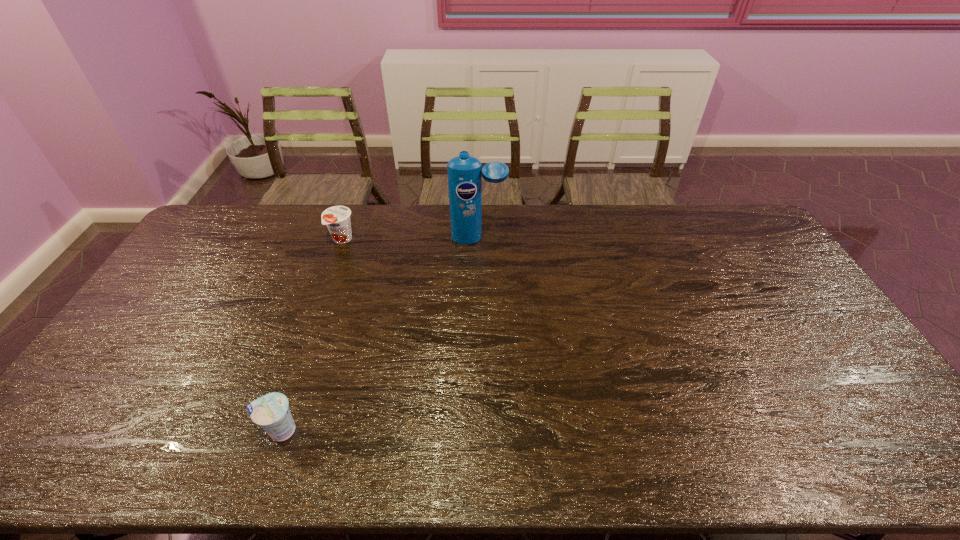
I want to click on vacant point located between the rightmost object and the nearer yogurt, so click(x=379, y=335).

Image resolution: width=960 pixels, height=540 pixels. What are the coordinates of `free space that is in between the farther yogurt and the nearest object` in the screenshot? It's located at (311, 335).

The image size is (960, 540). I want to click on vacant point located between the farther yogurt and the shampoo, so click(410, 239).

Where is `free point between the nearest object and the shampoo`? free point between the nearest object and the shampoo is located at coordinates (379, 335).

Where is `free space between the nearer yogurt and the farther yogurt`? Image resolution: width=960 pixels, height=540 pixels. free space between the nearer yogurt and the farther yogurt is located at coordinates (311, 335).

The height and width of the screenshot is (540, 960). Find the location of `object that is the nearest to the shampoo`. object that is the nearest to the shampoo is located at coordinates (337, 218).

Locate an element on the screen. The width and height of the screenshot is (960, 540). object that is the second nearest to the nearer yogurt is located at coordinates (465, 172).

Locate an element on the screen. vacant space that satisfies the following two spatial constraints: 1. on the front side of the farther yogurt; 2. on the left side of the nearest object is located at coordinates (275, 430).

The width and height of the screenshot is (960, 540). Find the location of `vacant area in the image that satisfies the following two spatial constraints: 1. on the back side of the nearer yogurt; 2. on the right side of the tallest object`. vacant area in the image that satisfies the following two spatial constraints: 1. on the back side of the nearer yogurt; 2. on the right side of the tallest object is located at coordinates (347, 239).

Locate an element on the screen. free location that satisfies the following two spatial constraints: 1. on the front side of the farther yogurt; 2. on the left side of the nearest object is located at coordinates (275, 430).